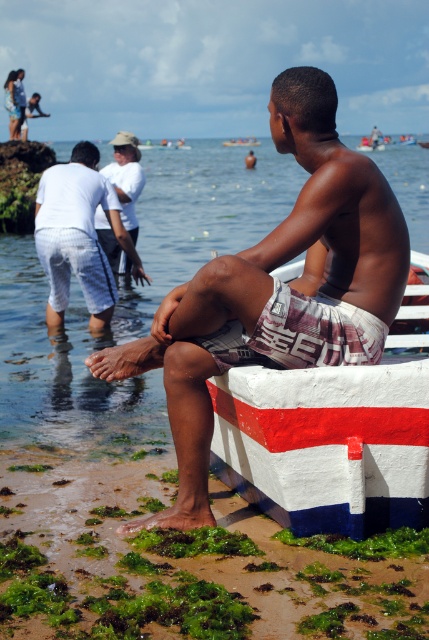
Can you confirm if white cotton shorts at center is positioned to the left of white painted wood boat at center?

Yes, white cotton shorts at center is to the left of white painted wood boat at center.

The height and width of the screenshot is (640, 429). Find the location of `white cotton shorts at center`. white cotton shorts at center is located at coordinates (78, 236).

Locate an element on the screen. The height and width of the screenshot is (640, 429). white cotton shorts at center is located at coordinates (78, 236).

You are a GUI agent. You are given a task and a screenshot of the screen. Output one action in this format:
    pyautogui.click(x=<x>, y=<y>)
    Task: Click on the white textured shorts at center
    The width and height of the screenshot is (429, 640).
    Given the screenshot: What is the action you would take?
    pyautogui.click(x=277, y=289)

Can you confirm if white textured shorts at center is thinner than white cotton shirt at upper left?

Incorrect, white textured shorts at center's width is not less than white cotton shirt at upper left's.

Is point (248, 308) more distant than point (109, 236)?

That is False.

Locate an element on the screen. The height and width of the screenshot is (640, 429). white textured shorts at center is located at coordinates (277, 289).

Can you confirm if white textured shorts at center is positioned to the right of white painted wood boat at center?

Correct, you'll find white textured shorts at center to the right of white painted wood boat at center.

Between white textured shorts at center and white painted wood boat at center, which one appears on the left side from the viewer's perspective?

Positioned to the left is white painted wood boat at center.

Find the location of a particular element. The height and width of the screenshot is (640, 429). white textured shorts at center is located at coordinates (277, 289).

I want to click on white textured shorts at center, so click(x=277, y=289).